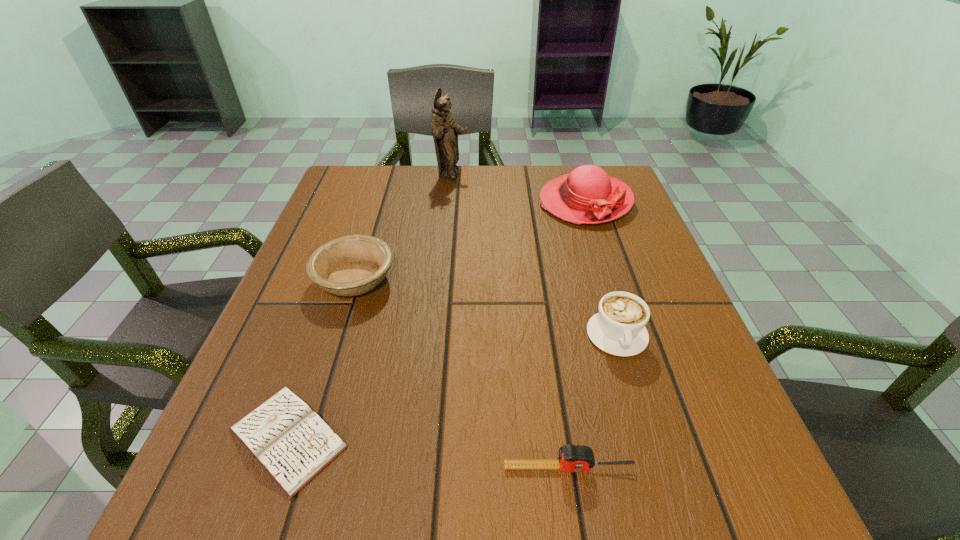
I want to click on figurine, so click(x=445, y=130).

Where is `the fourth object from right to left`? This screenshot has width=960, height=540. the fourth object from right to left is located at coordinates (445, 130).

This screenshot has height=540, width=960. What are the coordinates of `the second tallest object` in the screenshot? It's located at (587, 195).

At what (x,y) coordinates should I click in order to perform the action: click on the third tallest object. Please return your answer as a coordinate pair (x, y). This screenshot has height=540, width=960. Looking at the image, I should click on (619, 328).

This screenshot has width=960, height=540. I want to click on cappuccino, so click(619, 328).

Find the location of a particular element. This screenshot has height=540, width=960. the third farthest object is located at coordinates (352, 265).

What are the coordinates of `bowl` in the screenshot? It's located at (352, 265).

This screenshot has height=540, width=960. In order to click on tape measure in this screenshot , I will do `click(572, 458)`.

Identify the location of the shortest object. This screenshot has height=540, width=960. (293, 444).

Image resolution: width=960 pixels, height=540 pixels. I want to click on free spot located on the front-facing side of the tallest object, so click(x=529, y=175).